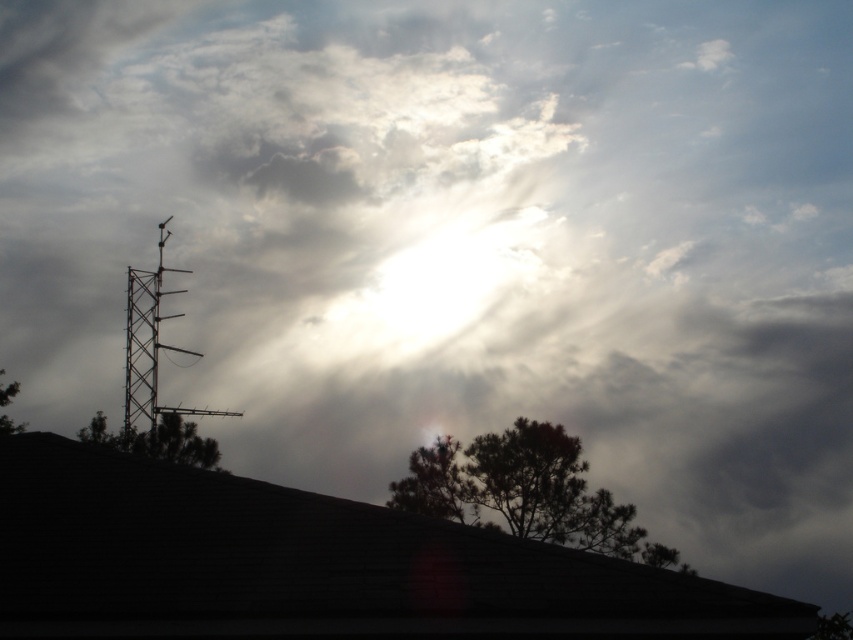
Does green leafy tree at center have a lesser width compared to green leafy tree at left?

Correct, green leafy tree at center's width is less than green leafy tree at left's.

Between point (445, 476) and point (0, 372), which one is positioned behind?

The point (0, 372) is behind.

You are a GUI agent. You are given a task and a screenshot of the screen. Output one action in this format:
    pyautogui.click(x=<x>, y=<y>)
    Task: Click on the green leafy tree at center
    
    Given the screenshot: What is the action you would take?
    pyautogui.click(x=431, y=483)

Can you confirm if dark green textured tree at upper center is positioned above green matte tree at center?

No.

At what (x,y) coordinates should I click in order to perform the action: click on dark green textured tree at upper center. Please return your answer as a coordinate pair (x, y). Looking at the image, I should click on (524, 492).

Which is below, dark green textured tree at upper center or green leafy tree at left?

dark green textured tree at upper center is below.

Can you confirm if dark green textured tree at upper center is positioned to the right of green leafy tree at left?

Indeed, dark green textured tree at upper center is positioned on the right side of green leafy tree at left.

Between point (508, 477) and point (10, 384), which one is positioned behind?

The point (10, 384) is behind.

This screenshot has width=853, height=640. Find the location of `dark green textured tree at upper center`. dark green textured tree at upper center is located at coordinates (524, 492).